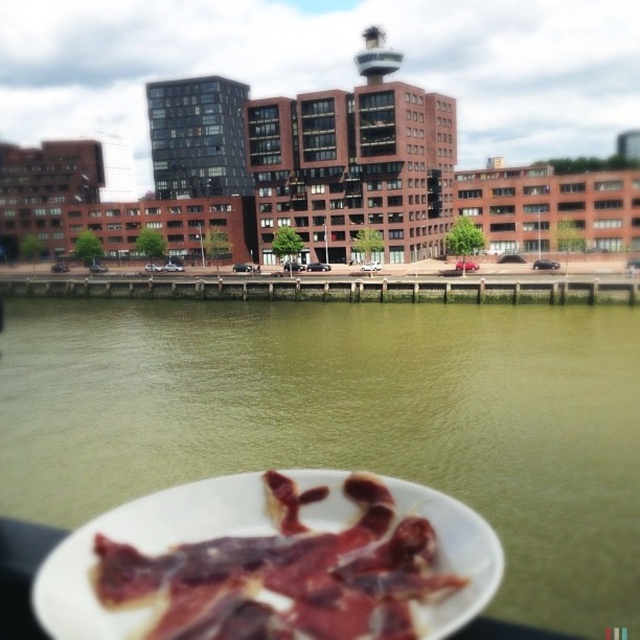
Question: From the image, what is the correct spatial relationship of greenish water at lower center in relation to sliced cured meat at bottom?

Choices:
 (A) below
 (B) above

Answer: (B)

Question: Is greenish water at lower center to the left of sliced cured meat at bottom from the viewer's perspective?

Choices:
 (A) yes
 (B) no

Answer: (A)

Question: Among these objects, which one is nearest to the camera?

Choices:
 (A) greenish water at lower center
 (B) sliced cured meat at bottom

Answer: (B)

Question: Which of the following is the farthest from the observer?

Choices:
 (A) (177, 397)
 (B) (291, 563)

Answer: (A)

Question: Does greenish water at lower center appear under sliced cured meat at bottom?

Choices:
 (A) no
 (B) yes

Answer: (A)